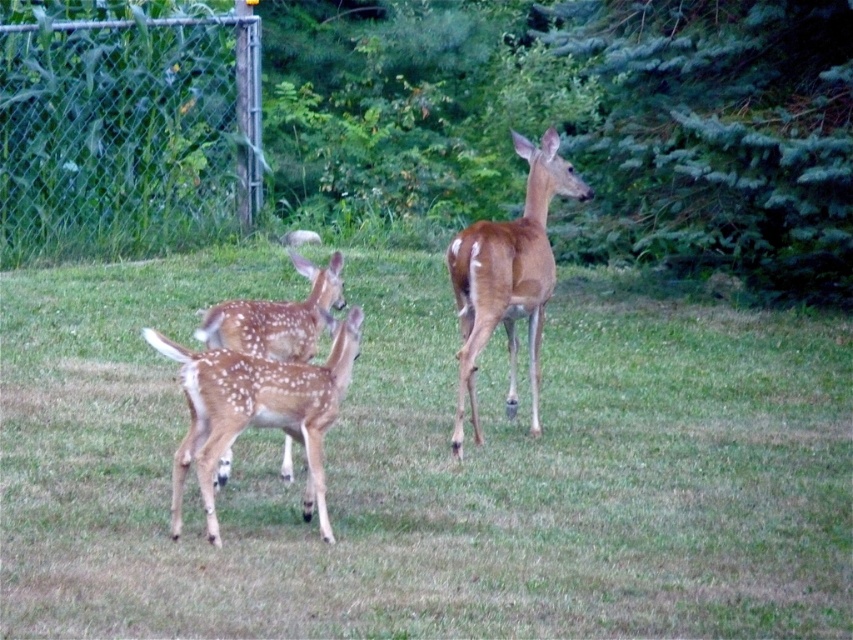
Between green grass at center and brown matte/deer at center, which one appears on the right side from the viewer's perspective?

brown matte/deer at center

Is point (727, 548) closer to viewer compared to point (538, 157)?

Yes, point (727, 548) is in front of point (538, 157).

This screenshot has height=640, width=853. I want to click on green grass at center, so click(428, 468).

Which of these two, green grass at center or spotted fur fawn at center, stands shorter?

Standing shorter between the two is green grass at center.

Is green grass at center taller than spotted fur fawn at center?

No, green grass at center is not taller than spotted fur fawn at center.

Measure the distance between green grass at center and camera.

green grass at center is 4.51 meters from camera.

Locate an element on the screen. green grass at center is located at coordinates (428, 468).

Does point (341, 364) come farther from viewer compared to point (254, 310)?

No.

Between point (199, 358) and point (254, 324), which one is positioned in front?

Point (199, 358)

The height and width of the screenshot is (640, 853). What are the coordinates of `spotted fur deer at center` in the screenshot? It's located at (257, 412).